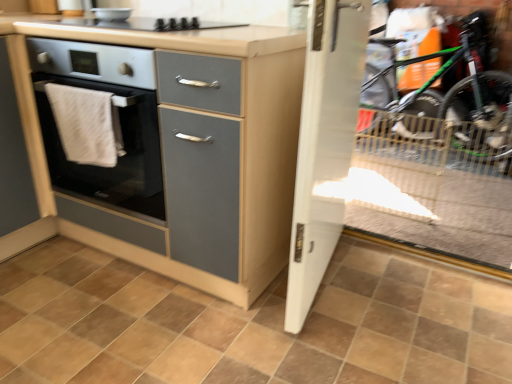
Locate an element on the screen. This screenshot has height=384, width=512. green matte mountain bike at right is located at coordinates (459, 90).

Describe the element at coordinates (459, 90) in the screenshot. I see `green matte mountain bike at right` at that location.

Measure the distance between point (x=52, y=381) and camera.

A distance of 1.22 meters exists between point (x=52, y=381) and camera.

The width and height of the screenshot is (512, 384). Find the location of `white cloth at left`. white cloth at left is located at coordinates (86, 124).

The width and height of the screenshot is (512, 384). What do you see at coordinates (112, 14) in the screenshot?
I see `white glossy bowl at upper center` at bounding box center [112, 14].

You are a GUI agent. You are given a task and a screenshot of the screen. Output one action in this format:
    pyautogui.click(x=<x>, y=<y>)
    Task: Click on the transparent glass door at right
    This screenshot has height=384, width=512.
    Given the screenshot: What is the action you would take?
    pyautogui.click(x=428, y=192)

What is the approximate height of matte gray cabinet at left?

It is 36.28 inches.

Where is `matte gray cabinet at center`? The height and width of the screenshot is (384, 512). matte gray cabinet at center is located at coordinates (202, 120).

At what (x,y) coordinates should I click in order to perform the action: click on white glossy door at center. Please return your answer as a coordinate pair (x, y). Looking at the image, I should click on (324, 144).

Choose the correct answer: Is brown matte tile at center inside transparent glass door at right or outside it?

brown matte tile at center is located beyond the bounds of transparent glass door at right.

Considering the sizes of objects brown matte tile at center and transparent glass door at right in the image provided, who is thinner, brown matte tile at center or transparent glass door at right?

Thinner between the two is brown matte tile at center.

Can you confirm if brown matte tile at center is shorter than transparent glass door at right?

No, brown matte tile at center is not shorter than transparent glass door at right.

Is brown matte tile at center far away from transparent glass door at right?

Yes, brown matte tile at center and transparent glass door at right are located far from each other.

Which object is closer to the camera taking this photo, white glossy bowl at upper center or transparent glass door at right?

white glossy bowl at upper center.

From the image's perspective, is white glossy bowl at upper center over transparent glass door at right?

Indeed, from the image's perspective, white glossy bowl at upper center is shown above transparent glass door at right.

Considering the positions of point (119, 16) and point (362, 142), is point (119, 16) closer or farther from the camera than point (362, 142)?

Point (119, 16) appears to be closer to the viewer than point (362, 142).

Which is more to the left, white glossy bowl at upper center or transparent glass door at right?

Positioned to the left is white glossy bowl at upper center.

Is matte gray cabinet at left turned away from matte gray cabinet at center?

No, matte gray cabinet at left's orientation is not away from matte gray cabinet at center.

From the image's perspective, is matte gray cabinet at left below matte gray cabinet at center?

Result: Indeed, from the image's perspective, matte gray cabinet at left is shown beneath matte gray cabinet at center.

Considering the sizes of objects matte gray cabinet at left and matte gray cabinet at center in the image provided, who is smaller, matte gray cabinet at left or matte gray cabinet at center?

matte gray cabinet at left is smaller.

Does matte gray cabinet at center touch brown matte tile at center?

No, matte gray cabinet at center is not in contact with brown matte tile at center.

Between matte gray cabinet at center and brown matte tile at center, which one has smaller width?

matte gray cabinet at center.

Between matte gray cabinet at center and brown matte tile at center, which one has more height?

matte gray cabinet at center is taller.

From the image's perspective, would you say matte gray cabinet at center is shown under brown matte tile at center?

Actually, matte gray cabinet at center appears above brown matte tile at center in the image.

Is white glossy bowl at upper center at the right side of matte gray cabinet at center?

Correct, you'll find white glossy bowl at upper center to the right of matte gray cabinet at center.

Considering the positions of points (115, 16) and (282, 71), is point (115, 16) closer to camera compared to point (282, 71)?

No.

How distant is white glossy bowl at upper center from matte gray cabinet at center?

white glossy bowl at upper center is 32.78 inches from matte gray cabinet at center.

Considering the relative sizes of white glossy bowl at upper center and matte gray cabinet at center in the image provided, is white glossy bowl at upper center shorter than matte gray cabinet at center?

Yes.

The height and width of the screenshot is (384, 512). I want to click on mountain bike on the right of white glossy door at center, so click(x=459, y=90).

Considering the sizes of objects white glossy door at center and green matte mountain bike at right in the image provided, who is shorter, white glossy door at center or green matte mountain bike at right?

→ green matte mountain bike at right is shorter.

From the image's perspective, is white glossy door at center positioned above or below green matte mountain bike at right?

From the image's perspective, white glossy door at center appears below green matte mountain bike at right.

From a real-world perspective, is white glossy door at center positioned under green matte mountain bike at right based on gravity?

Yes, from a real-world perspective, white glossy door at center is beneath green matte mountain bike at right.

Between green matte mountain bike at right and white glossy door at center, which one is positioned behind?

green matte mountain bike at right is behind.

Based on their positions, is green matte mountain bike at right located to the left or right of white glossy door at center?

Clearly, green matte mountain bike at right is on the right of white glossy door at center in the image.

Is green matte mountain bike at right positioned with its back to white glossy door at center?

green matte mountain bike at right is not turned away from white glossy door at center.

Can white glossy door at center be found inside green matte mountain bike at right?

Definitely not — white glossy door at center is not inside green matte mountain bike at right.

In the image, there is a transparent glass door at right. What are the coordinates of `ceramic tile below it (from the image's perspective)` in the screenshot? It's located at (250, 324).

This screenshot has width=512, height=384. Identify the location of appliance positioned vertically above the transparent glass door at right (from a real-world perspective). (112, 14).

Estimate the real-world distances between objects in this image. Which object is further from green matte mountain bike at right, transparent glass door at right or white cloth at left?

white cloth at left is positioned further to the anchor green matte mountain bike at right.

Based on the photo, which object lies nearer to the anchor point white glossy bowl at upper center, matte gray cabinet at left or matte gray cabinet at center?

The object closer to white glossy bowl at upper center is matte gray cabinet at left.

Based on their spatial positions, is matte gray cabinet at left or transparent glass door at right closer to matte gray cabinet at center?

matte gray cabinet at left.

Looking at the image, which one is located further to white glossy bowl at upper center, green matte mountain bike at right or white cloth at left?

green matte mountain bike at right is further to white glossy bowl at upper center.

When comparing their distances from matte gray cabinet at left, does transparent glass door at right or white glossy bowl at upper center seem closer?

→ Among the two, white glossy bowl at upper center is located nearer to matte gray cabinet at left.

Looking at the image, which one is located further to green matte mountain bike at right, white cloth at left or white glossy door at center?

white cloth at left is positioned further to the anchor green matte mountain bike at right.

Estimate the real-world distances between objects in this image. Which object is closer to transparent glass door at right, white cloth at left or green matte mountain bike at right?

green matte mountain bike at right is positioned closer to the anchor transparent glass door at right.

Which object lies further to the anchor point matte gray cabinet at left, transparent glass door at right or matte gray cabinet at center?

The object further to matte gray cabinet at left is transparent glass door at right.

Where is `ceramic tile between matte gray cabinet at left and green matte mountain bike at right from left to right`? This screenshot has width=512, height=384. ceramic tile between matte gray cabinet at left and green matte mountain bike at right from left to right is located at coordinates (250, 324).

The width and height of the screenshot is (512, 384). I want to click on hand towel that lies between matte gray cabinet at center and brown matte tile at center from top to bottom, so click(86, 124).

Locate an element on the screen. The image size is (512, 384). mountain bike located between brown matte tile at center and transparent glass door at right in the left-right direction is located at coordinates (x=459, y=90).

Identify the location of chest of drawers between matte gray cabinet at left and white glossy bowl at upper center from left to right. (202, 120).